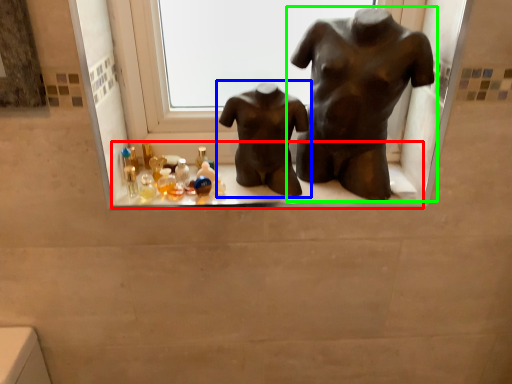
Question: Which object is positioned closest to window sill (highlighted by a red box)? Select from statue (sculpture) (highlighted by a blue box) and statue (sculpture) (highlighted by a green box).

Choices:
 (A) statue (sculpture)
 (B) statue (sculpture)

Answer: (A)